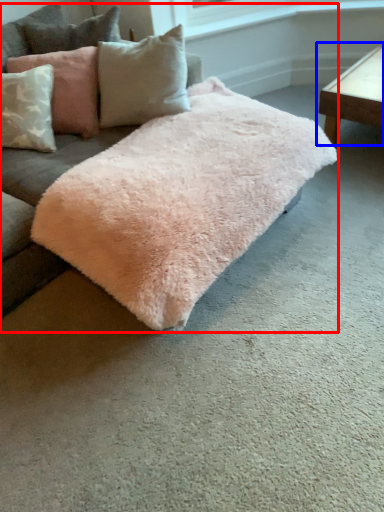
Question: Among these objects, which one is nearest to the camera, studio couch (highlighted by a red box) or table (highlighted by a blue box)?

Choices:
 (A) studio couch
 (B) table

Answer: (A)